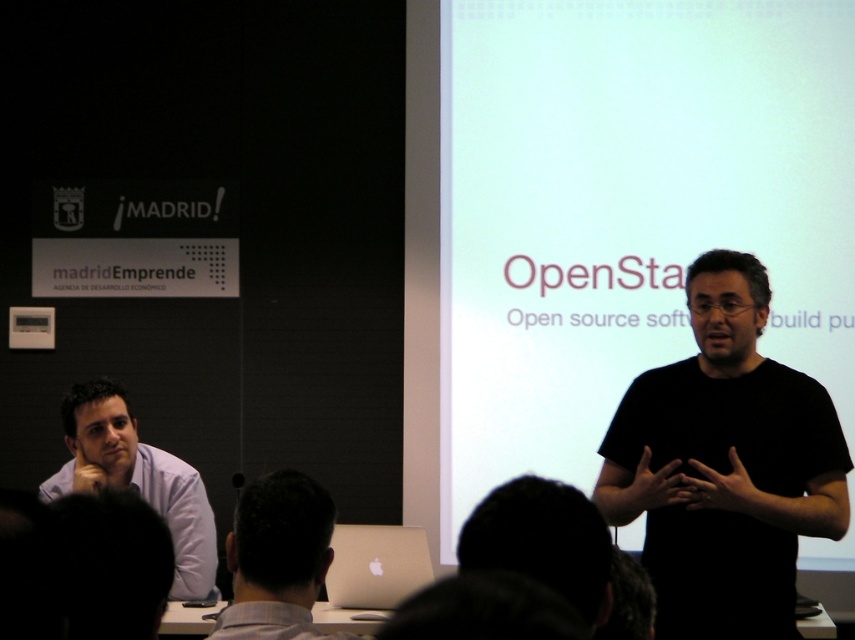
Question: From the image, what is the correct spatial relationship of black matte shirt at center in relation to gray fabric shirt at lower left?

Choices:
 (A) below
 (B) above

Answer: (B)

Question: Can you confirm if black matte shirt at center is positioned above light blue shirt at left?

Choices:
 (A) no
 (B) yes

Answer: (B)

Question: Which of the following is the farthest from the observer?

Choices:
 (A) (342, 572)
 (B) (171, 496)
 (C) (805, 221)
 (D) (316, 570)

Answer: (C)

Question: Which point appears farthest from the camera in this image?

Choices:
 (A) (541, 344)
 (B) (348, 557)
 (C) (116, 483)
 (D) (310, 592)

Answer: (A)

Question: Which is nearer to the light blue shirt at left?

Choices:
 (A) silver metallic laptop at lower center
 (B) black matte shirt at center

Answer: (A)

Question: Is white matte projection screen at center further to the viewer compared to light blue shirt at left?

Choices:
 (A) no
 (B) yes

Answer: (B)